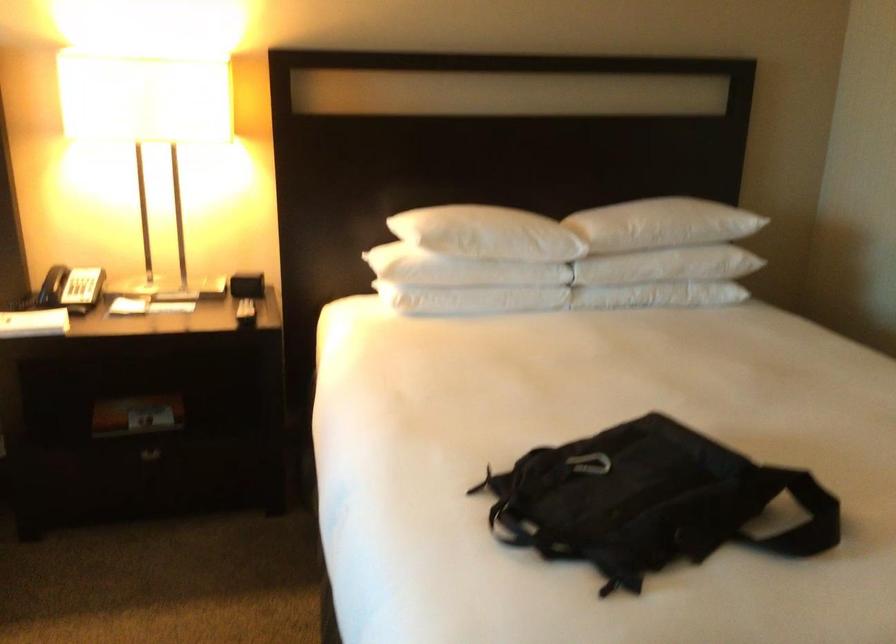
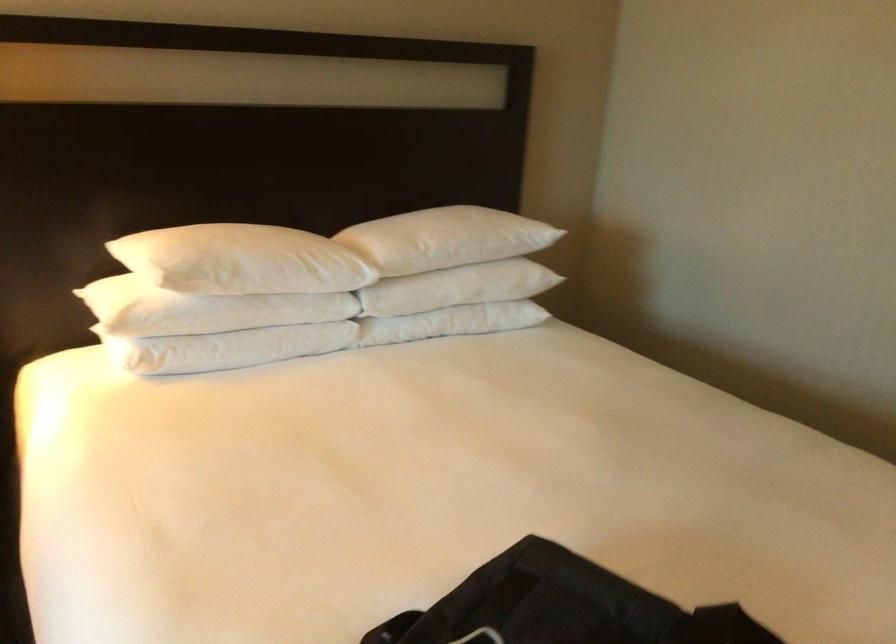
Question: Based on the continuous images, in which direction is the camera rotating? Reply with the corresponding letter.

Choices:
 (A) Left
 (B) Right
 (C) Up
 (D) Down

Answer: (B)